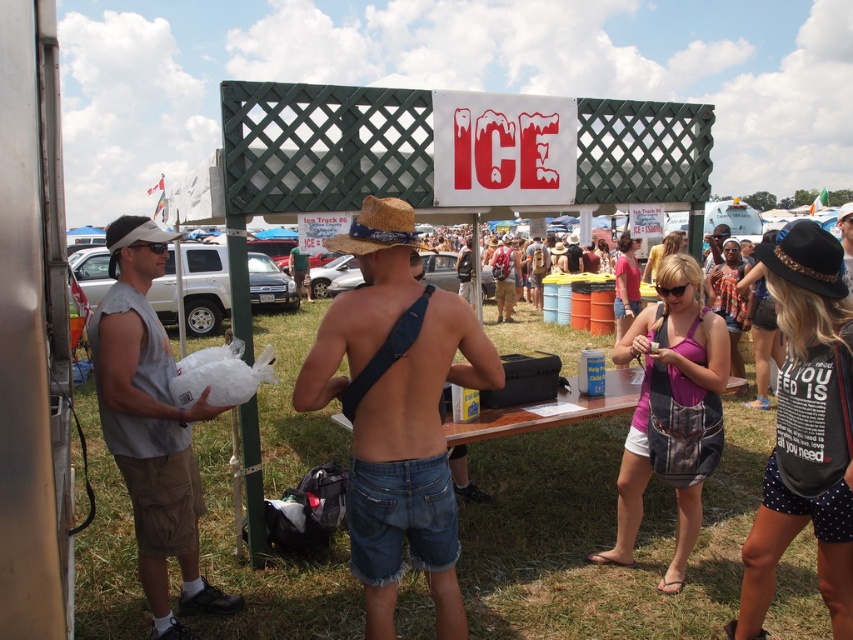
Is gray fabric shirt at left further to camera compared to strawhat at center?

Yes.

Find the location of `gray fabric shirt at left`. gray fabric shirt at left is located at coordinates point(151,426).

The width and height of the screenshot is (853, 640). I want to click on gray fabric shirt at left, so click(151, 426).

Is denim shorts at center to the right of strawhat at center from the viewer's perspective?

Yes, denim shorts at center is to the right of strawhat at center.

Can you confirm if denim shorts at center is positioned to the left of strawhat at center?

No, denim shorts at center is not to the left of strawhat at center.

Locate an element on the screen. Image resolution: width=853 pixels, height=640 pixels. denim shorts at center is located at coordinates (396, 412).

This screenshot has width=853, height=640. I want to click on denim shorts at center, so click(396, 412).

Can you confirm if denim shorts at center is positioned below gray fabric shirt at left?

No.

This screenshot has width=853, height=640. What do you see at coordinates (396, 412) in the screenshot?
I see `denim shorts at center` at bounding box center [396, 412].

At what (x,y) coordinates should I click in order to perform the action: click on denim shorts at center. Please return your answer as a coordinate pair (x, y). The image size is (853, 640). Looking at the image, I should click on (396, 412).